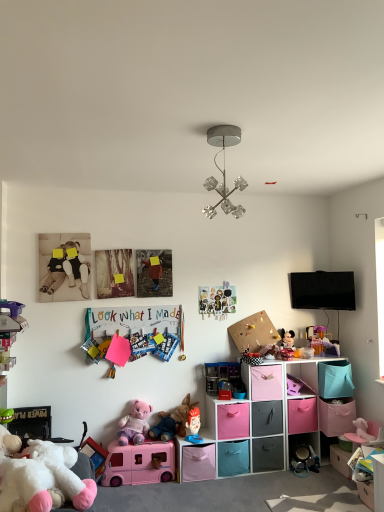
Describe the element at coordinates (198, 463) in the screenshot. I see `pink fabric storage box at lower center, arranged as the 2th storage box when ordered from the bottom` at that location.

The image size is (384, 512). What do you see at coordinates (139, 463) in the screenshot?
I see `matte pink plastic van at lower center, which ranks as the 3th toy in front-to-back order` at bounding box center [139, 463].

How much space does pink plush elephant at lower right, positioned as the 10th toy in back-to-front order, occupy horizontally?

pink plush elephant at lower right, positioned as the 10th toy in back-to-front order, is 5.42 inches in width.

What are the coordinates of `pink fabric drawer at lower center, positioned as the third drawer in bottom-to-top order` in the screenshot? It's located at (302, 415).

The height and width of the screenshot is (512, 384). What do you see at coordinates (166, 347) in the screenshot? I see `blue plastic toy at center, the fourth toy from the back` at bounding box center [166, 347].

You are a GUI agent. You are given a task and a screenshot of the screen. Output one action in this format:
    pyautogui.click(x=<x>, y=<y>)
    Task: Click on the pink fabric storage box at lower center, arranged as the first storage box when viewed from the left
    This screenshot has width=384, height=512.
    Given the screenshot: What is the action you would take?
    pyautogui.click(x=198, y=463)

Between matte plastic toy at center, arranged as the 6th toy when viewed from the back, and clear glass chandelier at upper center, which one appears on the left side from the viewer's perspective?

Positioned to the left is matte plastic toy at center, arranged as the 6th toy when viewed from the back.

Which of these two, matte plastic toy at center, which appears as the sixth toy when viewed from the front, or clear glass chandelier at upper center, is smaller?

matte plastic toy at center, which appears as the sixth toy when viewed from the front.

Is point (190, 433) in front of point (235, 126)?

That is False.

From a real-world perspective, which is physically above, matte plastic toy at center, arranged as the 6th toy when viewed from the back, or clear glass chandelier at upper center?

clear glass chandelier at upper center is physically above.

From a real-world perspective, is matte gray drawer at center, which ranks as the first drawer in bottom-to-top order, physically located above or below blue plastic toy at center, the fourth toy from the back?

Clearly, from a real-world perspective, matte gray drawer at center, which ranks as the first drawer in bottom-to-top order, is below blue plastic toy at center, the fourth toy from the back.

Is matte gray drawer at center, the 6th drawer viewed from the top, with blue plastic toy at center, the fourth toy from the back?

No.

Is matte gray drawer at center, which ranks as the first drawer in bottom-to-top order, positioned with its back to blue plastic toy at center, the fourth toy from the back?

matte gray drawer at center, which ranks as the first drawer in bottom-to-top order, does not have its back to blue plastic toy at center, the fourth toy from the back.

Locate an element on the screen. The width and height of the screenshot is (384, 512). drawer that is the 3rd one below the plush pink fabric teddy bear at lower center, marked as the 4th toy in a front-to-back arrangement (from a real-world perspective) is located at coordinates (302, 415).

Does point (301, 428) appear closer or farther from the camera than point (118, 435)?

Point (301, 428) is positioned farther from the camera compared to point (118, 435).

Based on the photo, from a real-world perspective, which is physically below, pink fabric drawer at lower center, marked as the fourth drawer in a top-to-bottom arrangement, or plush pink fabric teddy bear at lower center, the 8th toy positioned from the back?

pink fabric drawer at lower center, marked as the fourth drawer in a top-to-bottom arrangement.

Is clear glass chandelier at upper center shorter than pink fabric drawer at center, which ranks as the third drawer in top-to-bottom order?

No.

From the image's perspective, is clear glass chandelier at upper center located above pink fabric drawer at center, the fourth drawer ordered from the bottom?

Correct, clear glass chandelier at upper center appears higher than pink fabric drawer at center, the fourth drawer ordered from the bottom, in the image.

How many degrees apart are the facing directions of clear glass chandelier at upper center and pink fabric drawer at center, which ranks as the third drawer in top-to-bottom order?

0.799 degrees separate the facing orientations of clear glass chandelier at upper center and pink fabric drawer at center, which ranks as the third drawer in top-to-bottom order.

Between clear glass chandelier at upper center and pink fabric drawer at center, the fourth drawer ordered from the bottom, which one is positioned in front?

clear glass chandelier at upper center is closer to the camera.

You are a GUI agent. You are given a task and a screenshot of the screen. Output one action in this format:
    pyautogui.click(x=<x>, y=<y>)
    Task: Click on the 4th toy behind the pink fabric drawer at lower center, positioned as the third drawer in bottom-to-top order
    The image size is (384, 512).
    Given the screenshot: What is the action you would take?
    pyautogui.click(x=321, y=341)

Do you think pink fabric drawer at lower center, marked as the fourth drawer in a top-to-bottom arrangement, is within translucent plastic container at upper right, the second toy viewed from the back, or outside of it?

pink fabric drawer at lower center, marked as the fourth drawer in a top-to-bottom arrangement, is outside translucent plastic container at upper right, the second toy viewed from the back.

Is pink fabric drawer at lower center, positioned as the third drawer in bottom-to-top order, turned away from translucent plastic container at upper right, which is the tenth toy from front to back?

pink fabric drawer at lower center, positioned as the third drawer in bottom-to-top order, does not have its back to translucent plastic container at upper right, which is the tenth toy from front to back.

From the image's perspective, does pink fabric drawer at center, the fourth drawer ordered from the bottom, appear lower than teal fabric storage box at right, the first storage box from the top?

Yes, from the image's perspective, pink fabric drawer at center, the fourth drawer ordered from the bottom, is below teal fabric storage box at right, the first storage box from the top.

Considering the positions of objects pink fabric drawer at center, which ranks as the third drawer in top-to-bottom order, and teal fabric storage box at right, arranged as the 3th storage box when ordered from the bottom, in the image provided, who is more to the right, pink fabric drawer at center, which ranks as the third drawer in top-to-bottom order, or teal fabric storage box at right, arranged as the 3th storage box when ordered from the bottom,?

teal fabric storage box at right, arranged as the 3th storage box when ordered from the bottom, is more to the right.

Which is behind, pink fabric drawer at center, the fourth drawer ordered from the bottom, or teal fabric storage box at right, arranged as the 3th storage box when ordered from the bottom?

teal fabric storage box at right, arranged as the 3th storage box when ordered from the bottom.

Who is bigger, pink fabric drawer at center, arranged as the second drawer when viewed from the top, or plush pink fabric teddy bear at lower center, the 8th toy positioned from the back?

pink fabric drawer at center, arranged as the second drawer when viewed from the top.

What's the angular difference between pink fabric drawer at center, arranged as the second drawer when viewed from the top, and plush pink fabric teddy bear at lower center, the 8th toy positioned from the back,'s facing directions?

They differ by 0.53 degrees in their facing directions.

In terms of height, does pink fabric drawer at center, arranged as the 5th drawer when ordered from the bottom, look taller or shorter compared to plush pink fabric teddy bear at lower center, the 8th toy positioned from the back?

Considering their sizes, pink fabric drawer at center, arranged as the 5th drawer when ordered from the bottom, has less height than plush pink fabric teddy bear at lower center, the 8th toy positioned from the back.

Looking at their sizes, would you say pink fabric drawer at center, arranged as the second drawer when viewed from the top, is wider or thinner than plush pink fabric teddy bear at lower center, marked as the 4th toy in a front-to-back arrangement?

Clearly, pink fabric drawer at center, arranged as the second drawer when viewed from the top, has more width compared to plush pink fabric teddy bear at lower center, marked as the 4th toy in a front-to-back arrangement.

The height and width of the screenshot is (512, 384). Identify the location of the 5th toy behind when counting from the clear glass chandelier at upper center. (193, 426).

Locate an element on the screen. This screenshot has height=512, width=384. the 6th drawer below the blue plastic toy at center, positioned as the eighth toy in front-to-back order (from a real-world perspective) is located at coordinates (x=267, y=454).

Based on their spatial positions, is pink fabric storage box at lower center, arranged as the 2th storage box when ordered from the bottom, or blue plastic toy at center, positioned as the eighth toy in front-to-back order, further from teal fabric storage box at right, arranged as the 3th storage box when ordered from the bottom?

The object further to teal fabric storage box at right, arranged as the 3th storage box when ordered from the bottom, is blue plastic toy at center, positioned as the eighth toy in front-to-back order.

Estimate the real-world distances between objects in this image. Which object is closer to plush fabric figurine at center, the seventh toy positioned from the back, teal fabric storage box at right, which ranks as the second storage box in right-to-left order, or pink fabric drawer at lower center, marked as the fourth drawer in a top-to-bottom arrangement?

pink fabric drawer at lower center, marked as the fourth drawer in a top-to-bottom arrangement, lies closer to plush fabric figurine at center, the seventh toy positioned from the back, than the other object.

From the image, which object appears to be farther from matte gray drawer at center, the 6th drawer viewed from the top, teal fabric storage box at right, which ranks as the second storage box in right-to-left order, or pink fabric drawer at center, which ranks as the third drawer in top-to-bottom order?

teal fabric storage box at right, which ranks as the second storage box in right-to-left order, is further to matte gray drawer at center, the 6th drawer viewed from the top.

When comparing their distances from pink fabric drawer at lower center, positioned as the third drawer in bottom-to-top order, does matte paper collage at center, the first toy viewed from the back, or pink fabric storage box at lower center, arranged as the 2th storage box when ordered from the bottom, seem further?

The object further to pink fabric drawer at lower center, positioned as the third drawer in bottom-to-top order, is matte paper collage at center, the first toy viewed from the back.

Estimate the real-world distances between objects in this image. Which object is further from pink fabric drawer at center, arranged as the second drawer when viewed from the top, pink fabric storage box at lower right, marked as the third storage box in a top-to-bottom arrangement, or matte pink drawer at lower center, marked as the fifth drawer in a top-to-bottom arrangement?

Based on the image, pink fabric storage box at lower right, marked as the third storage box in a top-to-bottom arrangement, appears to be further to pink fabric drawer at center, arranged as the second drawer when viewed from the top.

Which object lies nearer to the anchor point pink fabric drawer at center, which ranks as the third drawer in top-to-bottom order, pink fabric drawer at lower center, marked as the fourth drawer in a top-to-bottom arrangement, or matte pink drawer at lower center, which is counted as the second drawer, starting from the bottom?

matte pink drawer at lower center, which is counted as the second drawer, starting from the bottom, is closer to pink fabric drawer at center, which ranks as the third drawer in top-to-bottom order.

Considering their positions, is white plush toy at lower left, positioned as the first toy in front-to-back order, positioned closer to blue plastic toy at center, positioned as the eighth toy in front-to-back order, than pink fabric storage box at lower center, arranged as the 2th storage box when ordered from the bottom?

The object closer to blue plastic toy at center, positioned as the eighth toy in front-to-back order, is pink fabric storage box at lower center, arranged as the 2th storage box when ordered from the bottom.

Considering their positions, is pink plush elephant at lower right, marked as the 2th toy in a front-to-back arrangement, positioned closer to multicolored paper at upper center, which appears as the seventh toy when viewed from the front, than matte pink drawer at lower center, which is counted as the second drawer, starting from the bottom?

Among the two, matte pink drawer at lower center, which is counted as the second drawer, starting from the bottom, is located nearer to multicolored paper at upper center, which appears as the seventh toy when viewed from the front.

Where is `shelf between matte plastic toy at center, which appears as the sixth toy when viewed from the front, and matte gray drawer at center, which ranks as the first drawer in bottom-to-top order`? This screenshot has width=384, height=512. shelf between matte plastic toy at center, which appears as the sixth toy when viewed from the front, and matte gray drawer at center, which ranks as the first drawer in bottom-to-top order is located at coordinates (251, 421).

Where is `storage box between white plush toy at lower left, positioned as the first toy in front-to-back order, and teal fabric storage box at right, which ranks as the second storage box in right-to-left order, from left to right`? storage box between white plush toy at lower left, positioned as the first toy in front-to-back order, and teal fabric storage box at right, which ranks as the second storage box in right-to-left order, from left to right is located at coordinates (198, 463).

You are a GUI agent. You are given a task and a screenshot of the screen. Output one action in this format:
    pyautogui.click(x=<x>, y=<y>)
    Task: Click on the storage box located between matte plastic toy at center, which appears as the sixth toy when viewed from the front, and pink fabric drawer at center, which ranks as the third drawer in top-to-bottom order, in the left-right direction
    The height and width of the screenshot is (512, 384).
    Given the screenshot: What is the action you would take?
    pyautogui.click(x=198, y=463)

The width and height of the screenshot is (384, 512). I want to click on storage box that lies between translucent plastic container at upper right, which is the tenth toy from front to back, and matte gray drawer at center, the 6th drawer viewed from the top, from top to bottom, so click(335, 379).